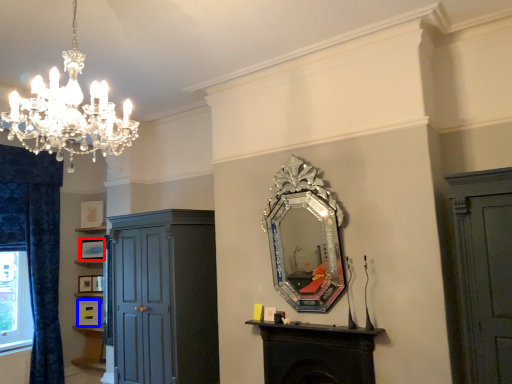
Question: Among these objects, which one is farthest to the camera, picture frame (highlighted by a red box) or picture frame (highlighted by a blue box)?

Choices:
 (A) picture frame
 (B) picture frame

Answer: (A)